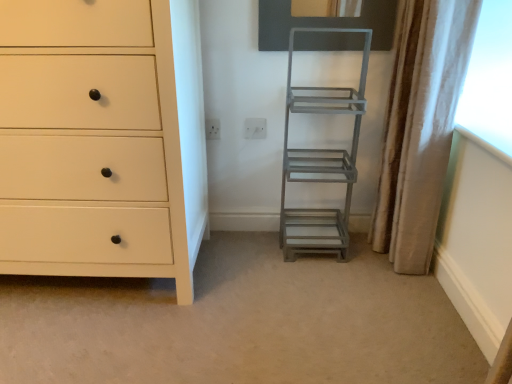
At what (x,y) coordinates should I click in order to perform the action: click on vacant area that lies to the right of matte white chest of drawers at left. Please return your answer as a coordinate pair (x, y). This screenshot has height=384, width=512. Looking at the image, I should click on (274, 298).